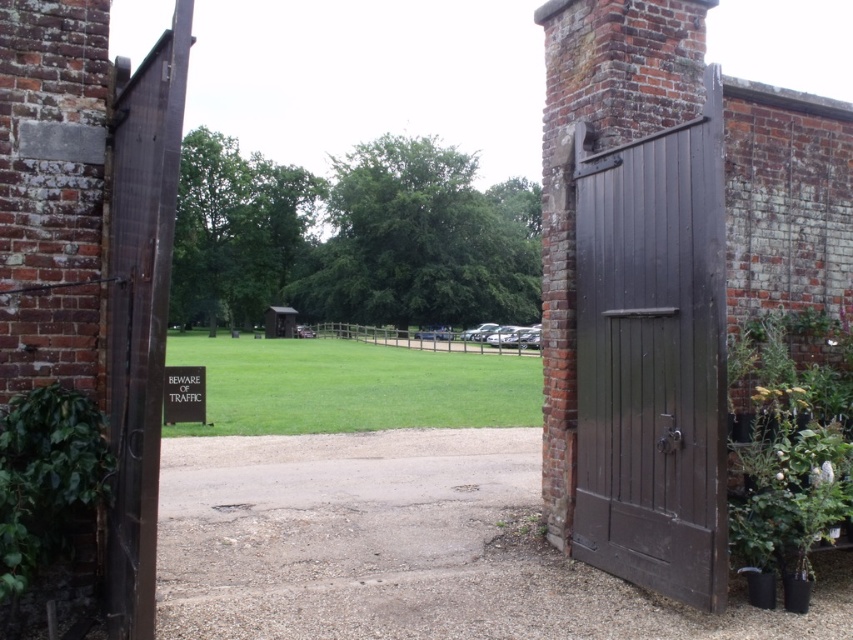
Measure the distance between point (788, 369) and camera.

A distance of 5.39 meters exists between point (788, 369) and camera.

Does green leafy plant at right appear under green leafy plant at left?

Actually, green leafy plant at right is above green leafy plant at left.

Does point (851, 413) lie behind point (12, 522)?

Yes, point (851, 413) is behind point (12, 522).

What are the coordinates of `green leafy plant at right` in the screenshot? It's located at (788, 456).

Which of these two, matte dark wood door at right or green leafy plant at left, stands taller?

With more height is matte dark wood door at right.

Which is above, matte dark wood door at right or green leafy plant at left?

Positioned higher is matte dark wood door at right.

Is point (583, 188) positioned before point (21, 538)?

That is False.

This screenshot has height=640, width=853. In order to click on matte dark wood door at right in this screenshot , I will do `click(653, 360)`.

This screenshot has width=853, height=640. In order to click on green grass at center in this screenshot , I will do `click(352, 387)`.

Between green grass at center and green leafy plant at right, which one has less height?

With less height is green grass at center.

Measure the distance between green grass at center and camera.

green grass at center is 12.80 meters away from camera.

Where is `green grass at center`? green grass at center is located at coordinates (352, 387).